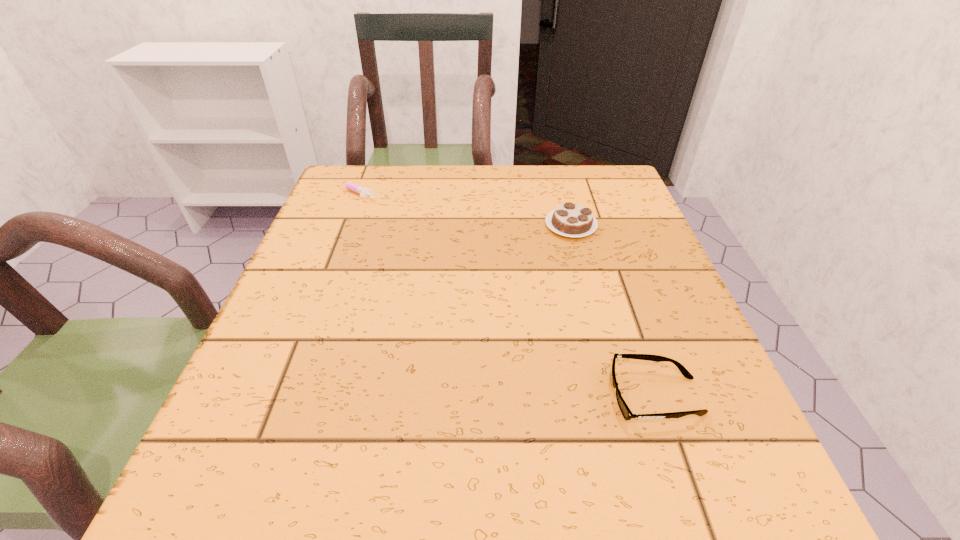
The width and height of the screenshot is (960, 540). In the image, there is a desktop. In order to click on free space at the far left corner in this screenshot , I will do `click(337, 177)`.

The image size is (960, 540). In order to click on vacant position at the near left corner of the desktop in this screenshot , I will do `click(203, 463)`.

Identify the location of vacant space at the far right corner of the desktop. (574, 177).

Locate an element on the screen. This screenshot has height=540, width=960. free space at the near right corner is located at coordinates (659, 482).

I want to click on blank region between the second farthest object and the leftmost object, so click(462, 209).

This screenshot has width=960, height=540. Identify the location of free space between the shortest object and the chocolate cake. point(462,209).

I want to click on vacant point located between the nearest object and the second farthest object, so click(613, 311).

Where is `free space between the chocolate cake and the sunglasses`? The height and width of the screenshot is (540, 960). free space between the chocolate cake and the sunglasses is located at coordinates (613, 311).

Where is `vacant space in between the sunglasses and the leftmost object`? This screenshot has width=960, height=540. vacant space in between the sunglasses and the leftmost object is located at coordinates [x=505, y=294].

Locate an element on the screen. The height and width of the screenshot is (540, 960). free space between the nearest object and the chocolate cake is located at coordinates (613, 311).